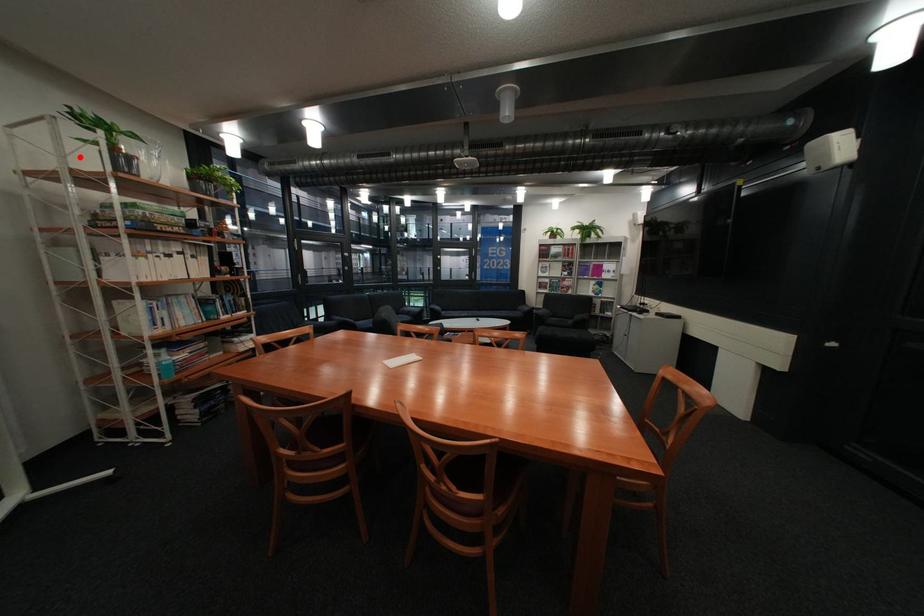
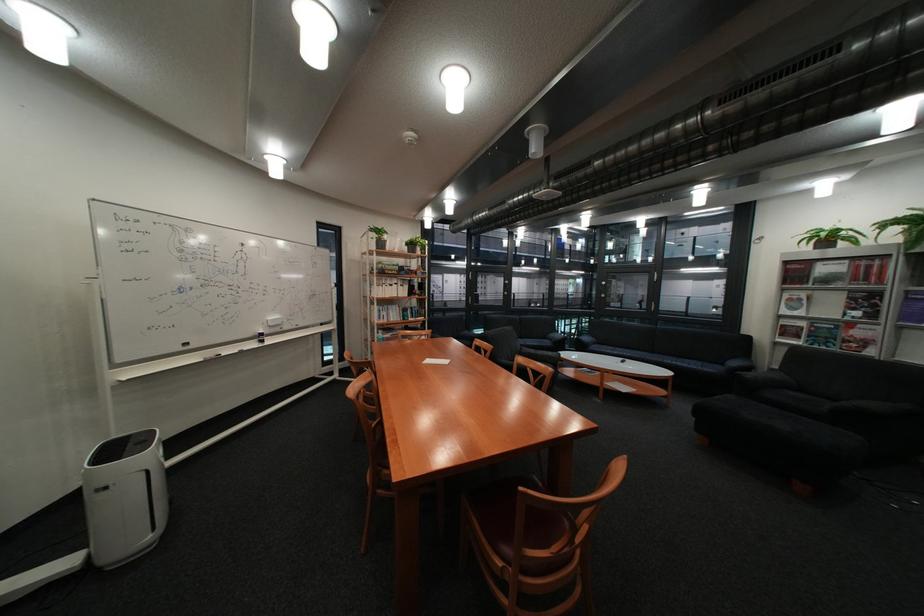
Question: I am providing you with two images of the same scene from different viewpoints. Given a red point in image1, look at the same physical point in image2. Is it:

Choices:
 (A) Closer to the viewpoint
 (B) Farther from the viewpoint

Answer: (A)